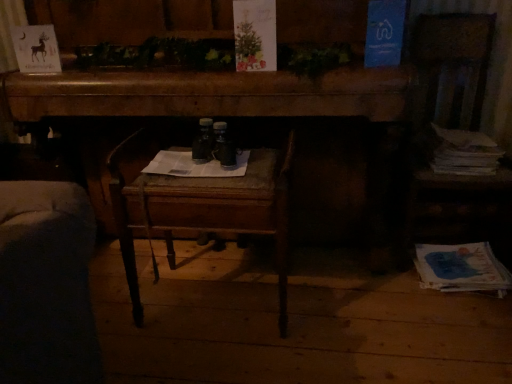
Question: From the image's perspective, is blue paper at lower right, the 2th magazine from the top, above wooden chair at center?

Choices:
 (A) yes
 (B) no

Answer: (B)

Question: Would you say blue paper at lower right, the 1th magazine positioned from the bottom, is outside wooden chair at center?

Choices:
 (A) yes
 (B) no

Answer: (A)

Question: Does blue paper at lower right, the 1th magazine positioned from the bottom, appear on the left side of wooden chair at center?

Choices:
 (A) no
 (B) yes

Answer: (A)

Question: Can you confirm if blue paper at lower right, the 2th magazine from the top, is wider than wooden chair at center?

Choices:
 (A) yes
 (B) no

Answer: (B)

Question: Is blue paper at lower right, the 2th magazine from the top, taller than wooden chair at center?

Choices:
 (A) no
 (B) yes

Answer: (A)

Question: Considering the relative sizes of blue paper at lower right, the 2th magazine from the top, and wooden chair at center in the image provided, is blue paper at lower right, the 2th magazine from the top, thinner than wooden chair at center?

Choices:
 (A) yes
 (B) no

Answer: (A)

Question: Is wooden desk at center oriented towards wooden chair at center?

Choices:
 (A) no
 (B) yes

Answer: (B)

Question: Is wooden desk at center next to wooden chair at center and touching it?

Choices:
 (A) no
 (B) yes

Answer: (A)

Question: From the image's perspective, is wooden desk at center above wooden chair at center?

Choices:
 (A) yes
 (B) no

Answer: (A)

Question: From the image's perspective, would you say wooden desk at center is shown under wooden chair at center?

Choices:
 (A) yes
 (B) no

Answer: (B)

Question: Is the depth of wooden desk at center less than that of wooden chair at center?

Choices:
 (A) no
 (B) yes

Answer: (A)

Question: Is wooden desk at center looking in the opposite direction of wooden chair at center?

Choices:
 (A) yes
 (B) no

Answer: (A)

Question: Can you confirm if wooden chair at center is positioned to the right of white paper stack at right, positioned as the 2th magazine in bottom-to-top order?

Choices:
 (A) no
 (B) yes

Answer: (A)